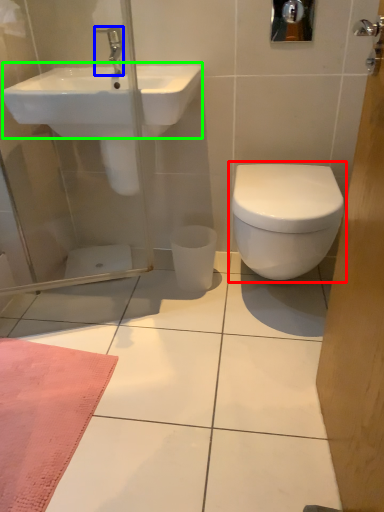
Question: Which object is the farthest from toilet (highlighted by a red box)? Choose among these: tap (highlighted by a blue box) or sink (highlighted by a green box).

Choices:
 (A) tap
 (B) sink

Answer: (A)